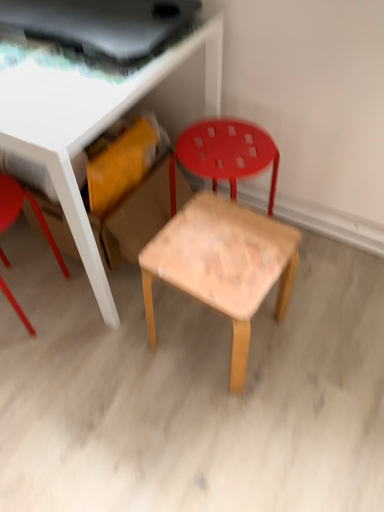
Question: Is point (112, 109) closer or farther from the camera than point (190, 160)?

Choices:
 (A) farther
 (B) closer

Answer: (B)

Question: Would you say wooden table at center is to the left or to the right of wooden chair at center, marked as the second chair in a left-to-right arrangement, in the picture?

Choices:
 (A) left
 (B) right

Answer: (A)

Question: Based on their relative distances, which object is farther from the wooden chair at center, which is the 1th chair in right-to-left order?

Choices:
 (A) natural wood stool at center
 (B) matte red stool at left, which is the 1th chair from left to right
 (C) wooden table at center

Answer: (B)

Question: Which object is positioned farthest from the wooden table at center?

Choices:
 (A) wooden chair at center, marked as the second chair in a left-to-right arrangement
 (B) natural wood stool at center
 (C) matte red stool at left, which is the 2th chair from right to left

Answer: (C)